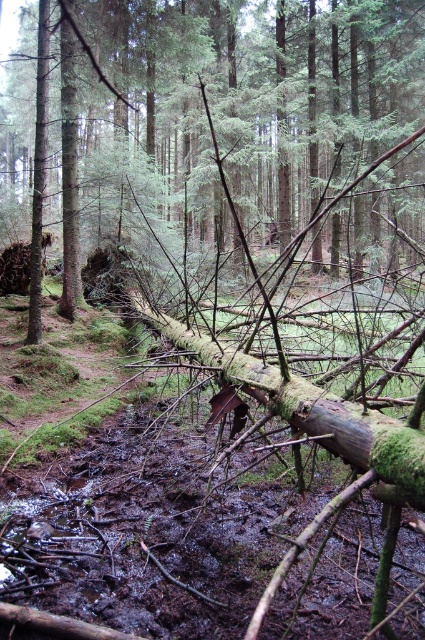
Is green mossy log at center above muddy wet log at center?

Indeed, green mossy log at center is positioned over muddy wet log at center.

The width and height of the screenshot is (425, 640). I want to click on green mossy log at center, so click(226, 148).

Who is more distant from viewer, (337, 61) or (272, 620)?

The point (337, 61) is more distant.

I want to click on green mossy log at center, so click(226, 148).